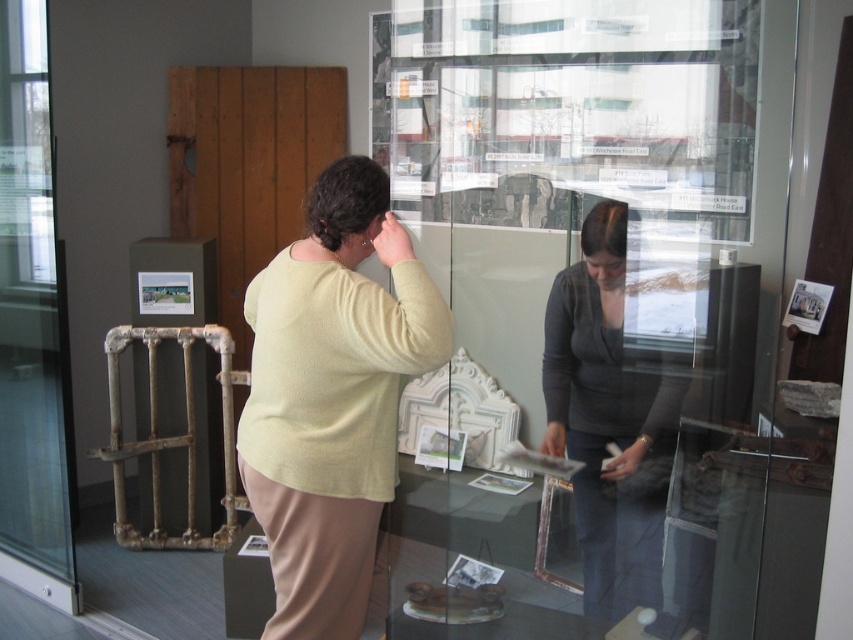
You are a museum visitor and you see two sweaters displayed in the glass case. The light yellow sweater at center and the dark gray sweater at center. Which one is placed above the other?

The light yellow sweater at center is positioned over dark gray sweater at center, so the light yellow sweater is placed above the dark gray sweater.

You are standing in front of a display case in a museum. You see a dark gray sweater at center and a transparent glass door at left. Which object is nearer to you?

The dark gray sweater at center is closer to the viewer than the transparent glass door at left.